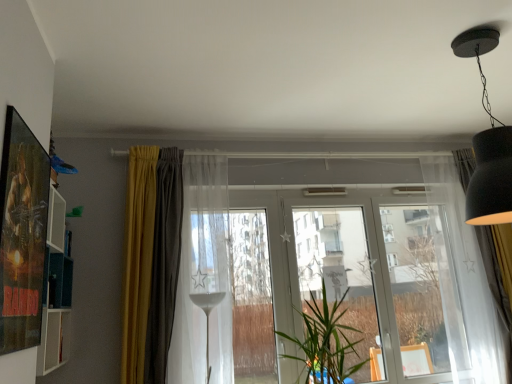
Question: Does transparent glass window at center have a larger size compared to transparent glass screen door at center, the 2th screen door when ordered from right to left?

Choices:
 (A) no
 (B) yes

Answer: (B)

Question: Is the depth of transparent glass window at center less than that of transparent glass screen door at center, which appears as the first screen door when viewed from the left?

Choices:
 (A) yes
 (B) no

Answer: (A)

Question: Is transparent glass window at center far from transparent glass screen door at center, which appears as the first screen door when viewed from the left?

Choices:
 (A) yes
 (B) no

Answer: (B)

Question: Could you tell me if transparent glass window at center is facing transparent glass screen door at center, which appears as the first screen door when viewed from the left?

Choices:
 (A) yes
 (B) no

Answer: (A)

Question: Can you confirm if transparent glass window at center is taller than transparent glass screen door at center, which appears as the first screen door when viewed from the left?

Choices:
 (A) no
 (B) yes

Answer: (A)

Question: In terms of size, does green leafy plant at center appear bigger or smaller than white sheer curtain at right, which is the 1th curtain in right-to-left order?

Choices:
 (A) big
 (B) small

Answer: (A)

Question: From the image's perspective, relative to white sheer curtain at right, positioned as the 3th curtain in left-to-right order, is green leafy plant at center above or below?

Choices:
 (A) below
 (B) above

Answer: (A)

Question: Is green leafy plant at center in front of or behind white sheer curtain at right, positioned as the 3th curtain in left-to-right order, in the image?

Choices:
 (A) front
 (B) behind

Answer: (A)

Question: Is green leafy plant at center wider or thinner than white sheer curtain at right, positioned as the 3th curtain in left-to-right order?

Choices:
 (A) thin
 (B) wide

Answer: (B)

Question: From a real-world perspective, is yellow fabric curtain at left, the 1th curtain when ordered from left to right, positioned above or below green leafy plant at center?

Choices:
 (A) above
 (B) below

Answer: (A)

Question: Is point (147, 253) positioned closer to the camera than point (323, 339)?

Choices:
 (A) closer
 (B) farther

Answer: (B)

Question: In terms of size, does yellow fabric curtain at left, the 1th curtain when ordered from left to right, appear bigger or smaller than green leafy plant at center?

Choices:
 (A) big
 (B) small

Answer: (B)

Question: In the image, is yellow fabric curtain at left, the 1th curtain when ordered from left to right, positioned in front of or behind green leafy plant at center?

Choices:
 (A) behind
 (B) front

Answer: (A)

Question: From the image's perspective, is transparent glass window frame at center above or below transparent glass wine glass at center?

Choices:
 (A) below
 (B) above

Answer: (B)

Question: Considering their positions, is transparent glass window frame at center located in front of or behind transparent glass wine glass at center?

Choices:
 (A) front
 (B) behind

Answer: (B)